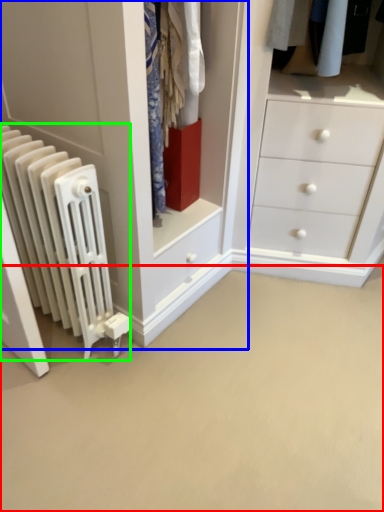
Question: Estimate the real-world distances between objects in this image. Which object is farther from plain (highlighted by a red box), closet (highlighted by a blue box) or radiator (highlighted by a green box)?

Choices:
 (A) closet
 (B) radiator

Answer: (A)